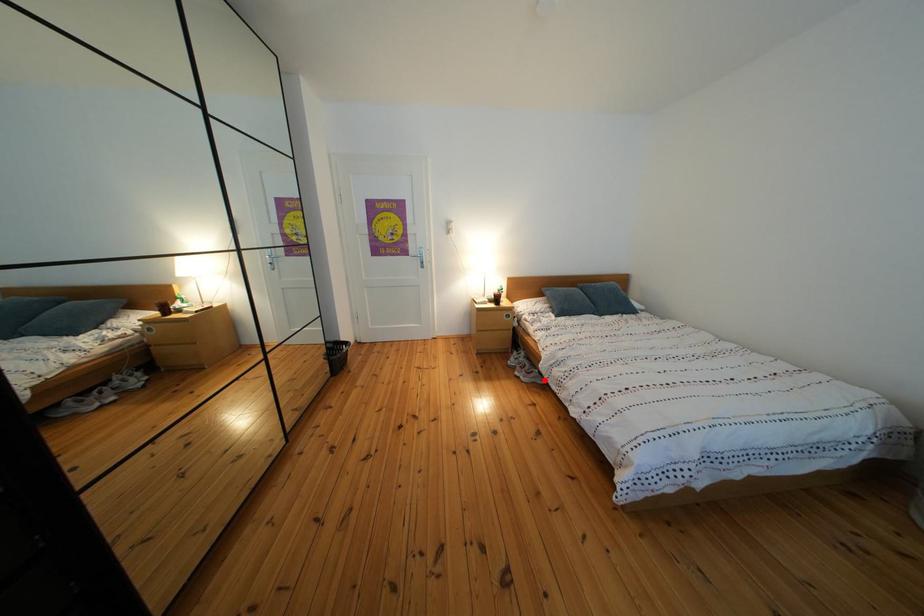
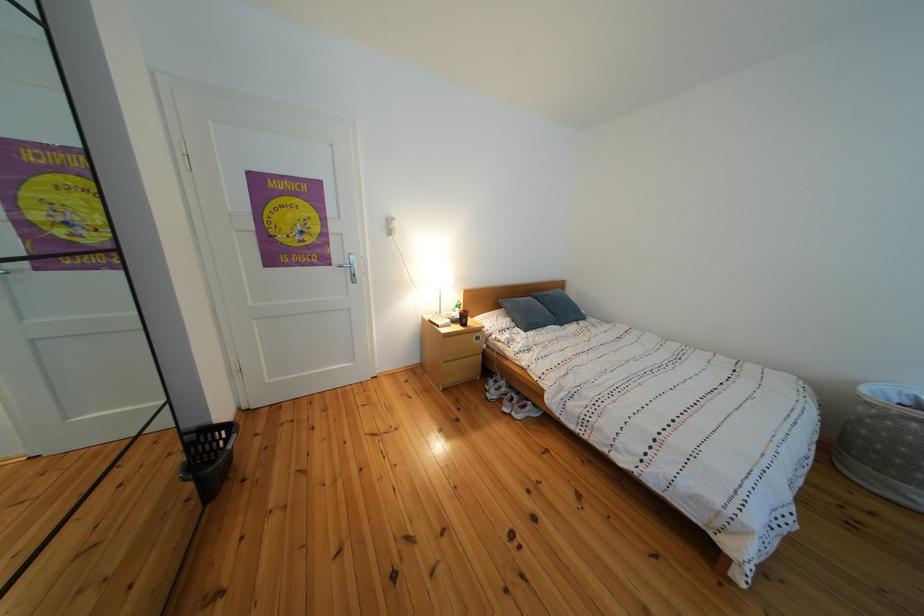
Find the pixel in the second image that matches the highlighted location in the first image.

(540, 414)